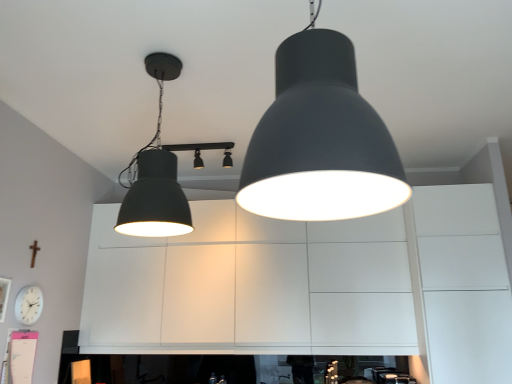
Find the location of `matte black lampshade at upper left, which is counted as the second lamp, starting from the back`. matte black lampshade at upper left, which is counted as the second lamp, starting from the back is located at coordinates (160, 172).

What do you see at coordinates (204, 149) in the screenshot? I see `matte black spotlights at center, marked as the first lamp in a back-to-front arrangement` at bounding box center [204, 149].

Where is `white matte clock at lower left`? white matte clock at lower left is located at coordinates (28, 305).

Locate an element on the screen. This screenshot has height=384, width=512. matte black lampshade at upper left, which is counted as the second lamp, starting from the back is located at coordinates (160, 172).

Where is `the 2nd lamp below when counting from the matte black lampshade at center, the 1th lamp from the front (from the image's perspective)`? Image resolution: width=512 pixels, height=384 pixels. the 2nd lamp below when counting from the matte black lampshade at center, the 1th lamp from the front (from the image's perspective) is located at coordinates (160, 172).

What's the angular difference between matte black lampshade at center, the 1th lamp from the front, and matte black lampshade at upper left, which is counted as the second lamp, starting from the back,'s facing directions?

The angular difference between matte black lampshade at center, the 1th lamp from the front, and matte black lampshade at upper left, which is counted as the second lamp, starting from the back, is 0.000137 degrees.

Does matte black lampshade at center, the 1th lamp from the front, turn towards matte black lampshade at upper left, which is counted as the second lamp, starting from the back?

No, matte black lampshade at center, the 1th lamp from the front, is not aimed at matte black lampshade at upper left, which is counted as the second lamp, starting from the back.

Would you consider matte black lampshade at center, the 1th lamp from the front, to be distant from matte black lampshade at upper left, which is counted as the second lamp, starting from the back?

No, there isn't a large distance between matte black lampshade at center, the 1th lamp from the front, and matte black lampshade at upper left, which is counted as the second lamp, starting from the back.

Considering the relative positions of matte black lampshade at center, the 1th lamp from the front, and white matte clock at lower left in the image provided, is matte black lampshade at center, the 1th lamp from the front, behind white matte clock at lower left?

That is False.

From a real-world perspective, who is located higher, matte black lampshade at center, the 1th lamp from the front, or white matte clock at lower left?

In real-world perspective, matte black lampshade at center, the 1th lamp from the front, is above.

Find the location of `lamp that is the 3rd object to the right of the white matte clock at lower left, starting at the anchor`. lamp that is the 3rd object to the right of the white matte clock at lower left, starting at the anchor is located at coordinates (320, 140).

Does point (354, 82) appear closer or farther from the camera than point (203, 149)?

Clearly, point (354, 82) is closer to the camera than point (203, 149).

Considering the positions of objects matte black lampshade at center, the 1th lamp from the front, and matte black spotlights at center, marked as the first lamp in a back-to-front arrangement, in the image provided, who is more to the right, matte black lampshade at center, the 1th lamp from the front, or matte black spotlights at center, marked as the first lamp in a back-to-front arrangement,?

matte black lampshade at center, the 1th lamp from the front, is more to the right.

Is matte black lampshade at center, the 1th lamp from the front, located outside matte black spotlights at center, marked as the first lamp in a back-to-front arrangement?

Yes, matte black lampshade at center, the 1th lamp from the front, is not within matte black spotlights at center, marked as the first lamp in a back-to-front arrangement.

From a real-world perspective, relative to matte black lampshade at upper left, which is the 2th lamp in front-to-back order, is white matte clock at lower left vertically above or below?

white matte clock at lower left is below matte black lampshade at upper left, which is the 2th lamp in front-to-back order.

Is white matte clock at lower left situated inside matte black lampshade at upper left, which is counted as the second lamp, starting from the back, or outside?

white matte clock at lower left lies outside matte black lampshade at upper left, which is counted as the second lamp, starting from the back.

Based on the photo, between white matte clock at lower left and matte black lampshade at upper left, which is the 2th lamp in front-to-back order, which one has smaller width?

With smaller width is white matte clock at lower left.

Based on the photo, which of these two, white matte clock at lower left or matte black lampshade at upper left, which is the 2th lamp in front-to-back order, stands shorter?

With less height is white matte clock at lower left.

From the image's perspective, relative to white matte clock at lower left, is matte black lampshade at upper left, which is counted as the second lamp, starting from the back, above or below?

Clearly, from the image's perspective, matte black lampshade at upper left, which is counted as the second lamp, starting from the back, is above white matte clock at lower left.

From a real-world perspective, is matte black lampshade at upper left, which is counted as the second lamp, starting from the back, physically below white matte clock at lower left?

No, from a real-world perspective, matte black lampshade at upper left, which is counted as the second lamp, starting from the back, is not under white matte clock at lower left.

Is matte black lampshade at upper left, which is counted as the second lamp, starting from the back, to the left or to the right of white matte clock at lower left in the image?

Clearly, matte black lampshade at upper left, which is counted as the second lamp, starting from the back, is on the right of white matte clock at lower left in the image.

Considering the positions of point (165, 214) and point (31, 290), is point (165, 214) closer or farther from the camera than point (31, 290)?

Point (165, 214) is positioned closer to the camera compared to point (31, 290).

Image resolution: width=512 pixels, height=384 pixels. I want to click on clock on the left of matte black spotlights at center, acting as the 3th lamp starting from the front, so click(x=28, y=305).

Which is more to the right, matte black spotlights at center, marked as the first lamp in a back-to-front arrangement, or white matte clock at lower left?

From the viewer's perspective, matte black spotlights at center, marked as the first lamp in a back-to-front arrangement, appears more on the right side.

Does matte black spotlights at center, marked as the first lamp in a back-to-front arrangement, come in front of white matte clock at lower left?

No.

Is matte black spotlights at center, marked as the first lamp in a back-to-front arrangement, oriented towards white matte clock at lower left?

No.

In the image, is matte black lampshade at upper left, which is counted as the second lamp, starting from the back, on the left side or the right side of matte black spotlights at center, acting as the 3th lamp starting from the front?

matte black lampshade at upper left, which is counted as the second lamp, starting from the back, is positioned on matte black spotlights at center, acting as the 3th lamp starting from the front,'s left side.

Is the surface of matte black lampshade at upper left, which is the 2th lamp in front-to-back order, in direct contact with matte black spotlights at center, marked as the first lamp in a back-to-front arrangement?

matte black lampshade at upper left, which is the 2th lamp in front-to-back order, is not next to matte black spotlights at center, marked as the first lamp in a back-to-front arrangement, and they're not touching.

Is matte black lampshade at upper left, which is counted as the second lamp, starting from the back, positioned behind matte black spotlights at center, marked as the first lamp in a back-to-front arrangement?

No, it is not.

The height and width of the screenshot is (384, 512). In order to click on lamp lying below the matte black spotlights at center, acting as the 3th lamp starting from the front (from the image's perspective) in this screenshot , I will do `click(160, 172)`.

At what (x,y) coordinates should I click in order to perform the action: click on lamp located underneath the matte black lampshade at upper left, which is counted as the second lamp, starting from the back (from a real-world perspective). Please return your answer as a coordinate pair (x, y). The image size is (512, 384). Looking at the image, I should click on (x=320, y=140).

Where is `the 1st lamp directly above the white matte clock at lower left (from a real-world perspective)`? the 1st lamp directly above the white matte clock at lower left (from a real-world perspective) is located at coordinates (320, 140).

Which object lies further to the anchor point matte black lampshade at upper left, which is the 2th lamp in front-to-back order, white matte clock at lower left or matte black spotlights at center, marked as the first lamp in a back-to-front arrangement?

The object further to matte black lampshade at upper left, which is the 2th lamp in front-to-back order, is matte black spotlights at center, marked as the first lamp in a back-to-front arrangement.

Based on their spatial positions, is matte black lampshade at center, the 3th lamp in the back-to-front sequence, or white matte clock at lower left further from matte black lampshade at upper left, which is the 2th lamp in front-to-back order?

The object further to matte black lampshade at upper left, which is the 2th lamp in front-to-back order, is white matte clock at lower left.

When comparing their distances from matte black spotlights at center, marked as the first lamp in a back-to-front arrangement, does white matte clock at lower left or matte black lampshade at center, the 3th lamp in the back-to-front sequence, seem closer?

white matte clock at lower left lies closer to matte black spotlights at center, marked as the first lamp in a back-to-front arrangement, than the other object.

Consider the image. Looking at the image, which one is located closer to matte black lampshade at upper left, which is counted as the second lamp, starting from the back, matte black spotlights at center, marked as the first lamp in a back-to-front arrangement, or matte black lampshade at center, the 3th lamp in the back-to-front sequence?

The object closer to matte black lampshade at upper left, which is counted as the second lamp, starting from the back, is matte black lampshade at center, the 3th lamp in the back-to-front sequence.

Looking at the image, which one is located closer to matte black lampshade at upper left, which is counted as the second lamp, starting from the back, white matte clock at lower left or matte black lampshade at center, the 1th lamp from the front?

matte black lampshade at center, the 1th lamp from the front, is closer to matte black lampshade at upper left, which is counted as the second lamp, starting from the back.

Looking at this image, looking at the image, which one is located closer to matte black lampshade at center, the 1th lamp from the front, white matte clock at lower left or matte black spotlights at center, marked as the first lamp in a back-to-front arrangement?

Among the two, matte black spotlights at center, marked as the first lamp in a back-to-front arrangement, is located nearer to matte black lampshade at center, the 1th lamp from the front.

Which object lies further to the anchor point matte black spotlights at center, marked as the first lamp in a back-to-front arrangement, white matte clock at lower left or matte black lampshade at upper left, which is the 2th lamp in front-to-back order?

Among the two, white matte clock at lower left is located further to matte black spotlights at center, marked as the first lamp in a back-to-front arrangement.

Estimate the real-world distances between objects in this image. Which object is further from matte black spotlights at center, acting as the 3th lamp starting from the front, matte black lampshade at center, the 1th lamp from the front, or matte black lampshade at upper left, which is counted as the second lamp, starting from the back?

matte black lampshade at center, the 1th lamp from the front, is further to matte black spotlights at center, acting as the 3th lamp starting from the front.

The width and height of the screenshot is (512, 384). Identify the location of lamp positioned between matte black lampshade at center, the 1th lamp from the front, and matte black spotlights at center, marked as the first lamp in a back-to-front arrangement, from near to far. (160, 172).

Find the location of `lamp located between matte black lampshade at center, the 1th lamp from the front, and white matte clock at lower left in the depth direction`. lamp located between matte black lampshade at center, the 1th lamp from the front, and white matte clock at lower left in the depth direction is located at coordinates (160, 172).

Find the location of a particular element. clock between matte black lampshade at center, the 1th lamp from the front, and matte black spotlights at center, acting as the 3th lamp starting from the front, in the front-back direction is located at coordinates (28, 305).

Locate an element on the screen. clock between matte black lampshade at upper left, which is counted as the second lamp, starting from the back, and matte black spotlights at center, marked as the first lamp in a back-to-front arrangement, in the front-back direction is located at coordinates (28, 305).